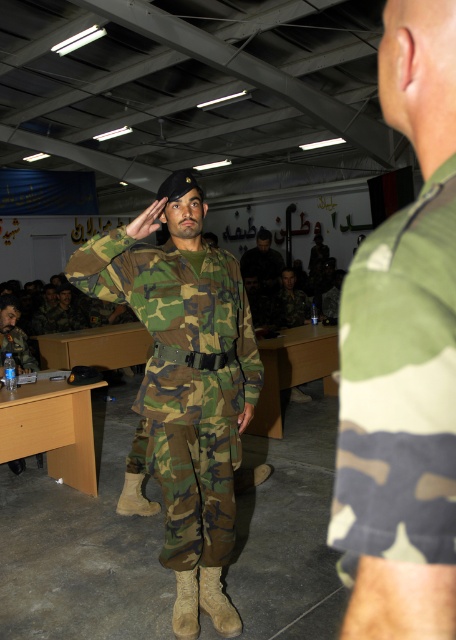
Question: Which point is farther to the camera?

Choices:
 (A) camo fabric uniform at right
 (B) matte camouflage uniform at center
 (C) camo fabric uniform at center

Answer: (B)

Question: Which point is closer to the camera?

Choices:
 (A) camo fabric uniform at right
 (B) camo fabric uniform at center
 (C) matte camouflage uniform at center

Answer: (A)

Question: From the image, what is the correct spatial relationship of camo fabric uniform at right in relation to camo fabric uniform at center?

Choices:
 (A) left
 (B) right

Answer: (B)

Question: Can you confirm if camo fabric uniform at right is thinner than camo fabric uniform at center?

Choices:
 (A) yes
 (B) no

Answer: (A)

Question: Among these objects, which one is nearest to the camera?

Choices:
 (A) camo fabric uniform at right
 (B) camo fabric uniform at center

Answer: (A)

Question: Is camo fabric uniform at center to the left of matte camouflage uniform at center from the viewer's perspective?

Choices:
 (A) no
 (B) yes

Answer: (A)